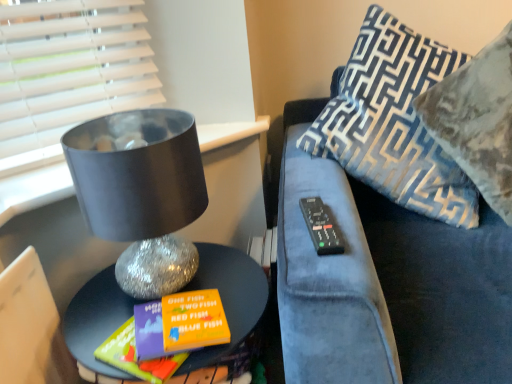
Locate an element on the screen. The height and width of the screenshot is (384, 512). free space above shiny metallic table at lower left (from a real-world perspective) is located at coordinates (156, 309).